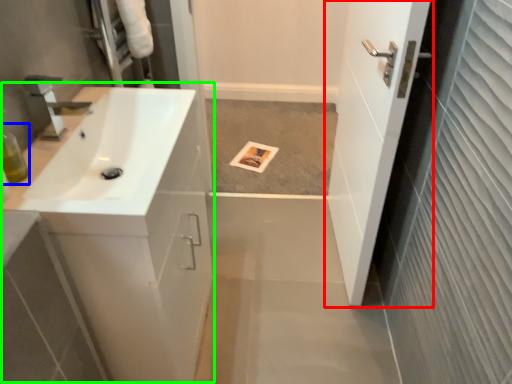
Question: Considering the real-world distances, which object is farthest from door (highlighted by a red box)? toiletry (highlighted by a blue box) or counter top (highlighted by a green box)?

Choices:
 (A) toiletry
 (B) counter top

Answer: (A)